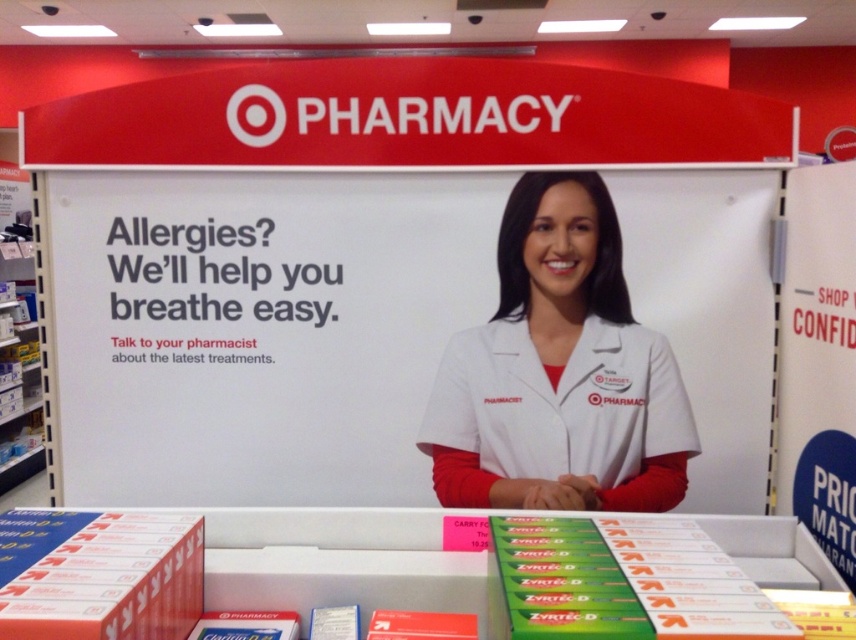
What do you see at coordinates (259, 330) in the screenshot?
I see `white paperboard at center` at bounding box center [259, 330].

Does white paperboard at center have a lesser width compared to white smooth coat at center?

Incorrect, white paperboard at center's width is not less than white smooth coat at center's.

Image resolution: width=856 pixels, height=640 pixels. Describe the element at coordinates (259, 330) in the screenshot. I see `white paperboard at center` at that location.

Where is `white paperboard at center`? white paperboard at center is located at coordinates (259, 330).